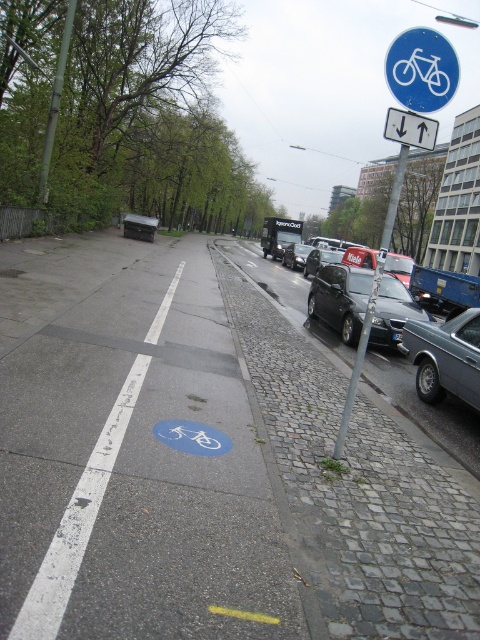
Question: Is blue asphalt bike lane at center smaller than metallic silver car at center?

Choices:
 (A) yes
 (B) no

Answer: (B)

Question: Does shiny black sedan at center appear under metallic silver car at center?

Choices:
 (A) yes
 (B) no

Answer: (A)

Question: Based on their relative distances, which object is nearer to the shiny black car at center?

Choices:
 (A) shiny black sedan at center
 (B) silver metallic sedan at right
 (C) shiny silver car at center

Answer: (C)

Question: Which object is closer to the camera taking this photo?

Choices:
 (A) shiny black car at center
 (B) white plastic bicycle at upper right
 (C) shiny silver car at center

Answer: (B)

Question: Which point is farther to the camera?

Choices:
 (A) tap(284, 266)
 (B) tap(456, 321)
 (C) tap(326, 304)
 (D) tap(147, 218)

Answer: (A)

Question: Is metallic silver car at center closer to the viewer compared to shiny silver car at center?

Choices:
 (A) no
 (B) yes

Answer: (A)